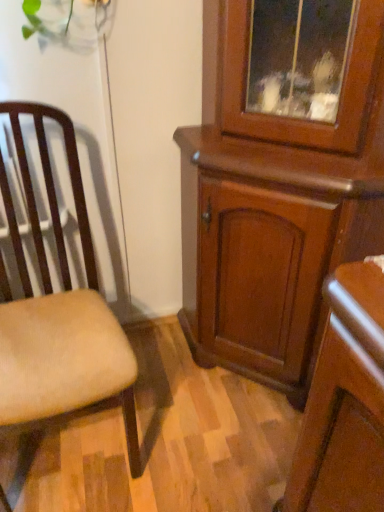
Where is `wooden cabinet at center`? wooden cabinet at center is located at coordinates (x=275, y=205).

What do you see at coordinates (275, 205) in the screenshot? Image resolution: width=384 pixels, height=512 pixels. I see `wooden cabinet at center` at bounding box center [275, 205].

Image resolution: width=384 pixels, height=512 pixels. Identify the location of beige fabric chair at left. (58, 310).

What do you see at coordinates (58, 310) in the screenshot? Image resolution: width=384 pixels, height=512 pixels. I see `beige fabric chair at left` at bounding box center [58, 310].

Measure the distance between point (7, 317) and camera.

A distance of 3.97 feet exists between point (7, 317) and camera.

You are a GUI agent. You are given a task and a screenshot of the screen. Output one action in this format:
    pyautogui.click(x=<x>, y=<y>)
    Task: Click on the wooden cabinet at center
    This screenshot has height=512, width=384.
    Given the screenshot: What is the action you would take?
    pyautogui.click(x=275, y=205)

Is wooden cabinet at center to the left or to the right of beige fabric chair at left in the image?

Based on their positions, wooden cabinet at center is located to the right of beige fabric chair at left.

Is wooden cabinet at center in front of or behind beige fabric chair at left in the image?

wooden cabinet at center is positioned farther from the viewer than beige fabric chair at left.

Which is closer to the camera, (x=222, y=68) or (x=71, y=333)?

Point (x=222, y=68) appears to be closer to the viewer than point (x=71, y=333).

From the image's perspective, which one is positioned higher, wooden cabinet at center or beige fabric chair at left?

wooden cabinet at center, from the image's perspective.

From a real-world perspective, which is physically below, wooden cabinet at center or beige fabric chair at left?

beige fabric chair at left.

Based on the photo, considering the relative sizes of wooden cabinet at center and beige fabric chair at left in the image provided, is wooden cabinet at center thinner than beige fabric chair at left?

Indeed, wooden cabinet at center has a lesser width compared to beige fabric chair at left.

Is wooden cabinet at center taller than beige fabric chair at left?

Correct, wooden cabinet at center is much taller as beige fabric chair at left.

Is wooden cabinet at center bigger than beige fabric chair at left?

Indeed, wooden cabinet at center has a larger size compared to beige fabric chair at left.

Is wooden cabinet at center situated inside beige fabric chair at left or outside?

wooden cabinet at center is located beyond the bounds of beige fabric chair at left.

Is wooden cabinet at center next to beige fabric chair at left?

There is a gap between wooden cabinet at center and beige fabric chair at left.

Is beige fabric chair at left at the back of wooden cabinet at center?

No.

Measure the distance between wooden cabinet at center and beige fabric chair at left.

wooden cabinet at center is 19.81 inches away from beige fabric chair at left.

Locate an element on the screen. The image size is (384, 512). chair that appears below the wooden cabinet at center (from the image's perspective) is located at coordinates (58, 310).

In the scene shown: Visually, is beige fabric chair at left positioned to the left or to the right of wooden cabinet at center?

Clearly, beige fabric chair at left is on the left of wooden cabinet at center in the image.

Is beige fabric chair at left further to the viewer compared to wooden cabinet at center?

No.

Consider the image. Which is farther from the camera, (81, 387) or (383, 119)?

The point (81, 387) is farther from the camera.

From the image's perspective, which one is positioned lower, beige fabric chair at left or wooden cabinet at center?

beige fabric chair at left.

From a real-world perspective, which object stands above the other?

wooden cabinet at center, from a real-world perspective.

Between beige fabric chair at left and wooden cabinet at center, which one has smaller width?

With smaller width is wooden cabinet at center.

Considering the sizes of objects beige fabric chair at left and wooden cabinet at center in the image provided, who is shorter, beige fabric chair at left or wooden cabinet at center?

beige fabric chair at left is shorter.

Considering the sizes of beige fabric chair at left and wooden cabinet at center in the image, is beige fabric chair at left bigger or smaller than wooden cabinet at center?

In the image, beige fabric chair at left appears to be smaller than wooden cabinet at center.

Would you say beige fabric chair at left is outside wooden cabinet at center?

Yes.

Is beige fabric chair at left far from wooden cabinet at center?

They are positioned close to each other.

Is beige fabric chair at left positioned with its back to wooden cabinet at center?

No, beige fabric chair at left is not facing the opposite direction of wooden cabinet at center.

Image resolution: width=384 pixels, height=512 pixels. Find the location of `cabinetry on the right of beige fabric chair at left`. cabinetry on the right of beige fabric chair at left is located at coordinates (275, 205).

I want to click on chair below the wooden cabinet at center (from the image's perspective), so click(58, 310).

Image resolution: width=384 pixels, height=512 pixels. Identify the location of chair in front of the wooden cabinet at center. (58, 310).